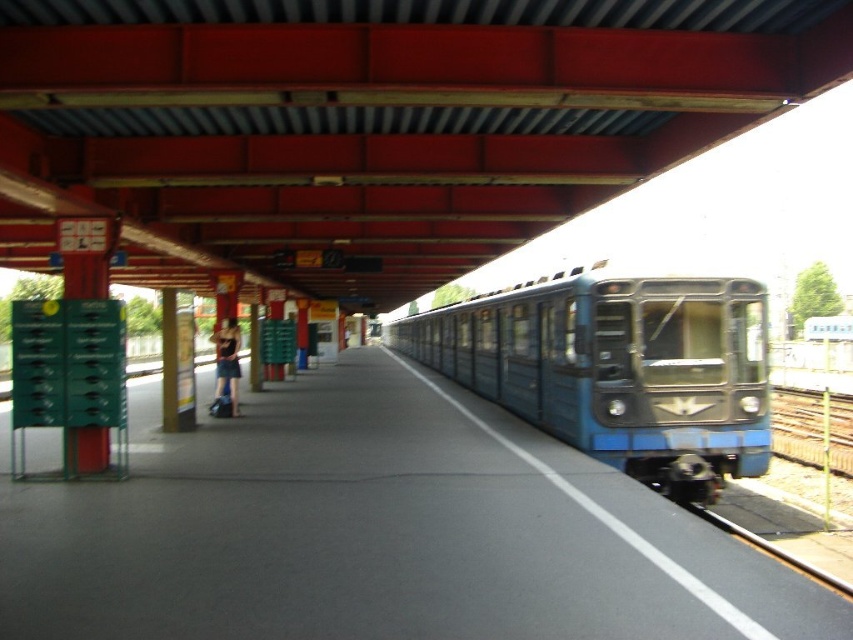
Question: Is blue metallic train at center above matte black dress at left?

Choices:
 (A) yes
 (B) no

Answer: (A)

Question: Does blue metallic train at center appear under matte black dress at left?

Choices:
 (A) yes
 (B) no

Answer: (B)

Question: Observing the image, what is the correct spatial positioning of blue metallic train at center in reference to matte black dress at left?

Choices:
 (A) above
 (B) below

Answer: (A)

Question: Among these points, which one is farthest from the camera?

Choices:
 (A) [x=648, y=346]
 (B) [x=231, y=348]

Answer: (B)

Question: Among these points, which one is nearest to the camera?

Choices:
 (A) (229, 403)
 (B) (480, 362)

Answer: (A)